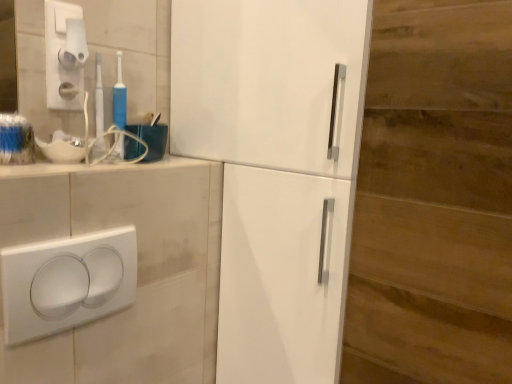
Question: Is white plastic toothbrush at upper left, arranged as the 2th toothbrush when viewed from the right, not close to blue plastic toothbrush at upper left, the second toothbrush from the left?

Choices:
 (A) yes
 (B) no

Answer: (B)

Question: From the image's perspective, is white plastic toothbrush at upper left, arranged as the 2th toothbrush when viewed from the right, below blue plastic toothbrush at upper left, the second toothbrush from the left?

Choices:
 (A) yes
 (B) no

Answer: (A)

Question: Is white plastic toothbrush at upper left, arranged as the 2th toothbrush when viewed from the right, to the right of blue plastic toothbrush at upper left, the 1th toothbrush from the right, from the viewer's perspective?

Choices:
 (A) no
 (B) yes

Answer: (A)

Question: Is white plastic toothbrush at upper left, arranged as the 2th toothbrush when viewed from the right, surrounding blue plastic toothbrush at upper left, the 1th toothbrush from the right?

Choices:
 (A) yes
 (B) no

Answer: (B)

Question: From a real-world perspective, is white plastic toothbrush at upper left, the 1th toothbrush viewed from the left, below blue plastic toothbrush at upper left, the second toothbrush from the left?

Choices:
 (A) yes
 (B) no

Answer: (A)

Question: Relative to beige ceramic counter top at upper left, is white glossy cabinet at center in front or behind?

Choices:
 (A) behind
 (B) front

Answer: (A)

Question: Do you think white glossy cabinet at center is within beige ceramic counter top at upper left, or outside of it?

Choices:
 (A) inside
 (B) outside

Answer: (B)

Question: In terms of width, does white glossy cabinet at center look wider or thinner when compared to beige ceramic counter top at upper left?

Choices:
 (A) thin
 (B) wide

Answer: (B)

Question: From a real-world perspective, is white glossy cabinet at center positioned above or below beige ceramic counter top at upper left?

Choices:
 (A) above
 (B) below

Answer: (B)

Question: In the image, is beige ceramic counter top at upper left positioned in front of or behind white glossy cabinet at center?

Choices:
 (A) front
 (B) behind

Answer: (A)

Question: Is beige ceramic counter top at upper left to the left or to the right of white glossy cabinet at center in the image?

Choices:
 (A) left
 (B) right

Answer: (A)

Question: From a real-world perspective, relative to white glossy cabinet at center, is beige ceramic counter top at upper left vertically above or below?

Choices:
 (A) below
 (B) above

Answer: (B)

Question: Looking at the image, does beige ceramic counter top at upper left seem bigger or smaller compared to white glossy cabinet at center?

Choices:
 (A) big
 (B) small

Answer: (B)

Question: Is point (64, 48) closer or farther from the camera than point (37, 170)?

Choices:
 (A) closer
 (B) farther

Answer: (B)

Question: Is white plastic light switch at upper left, arranged as the 1th light switch when viewed from the top, wider or thinner than beige ceramic counter top at upper left?

Choices:
 (A) thin
 (B) wide

Answer: (A)